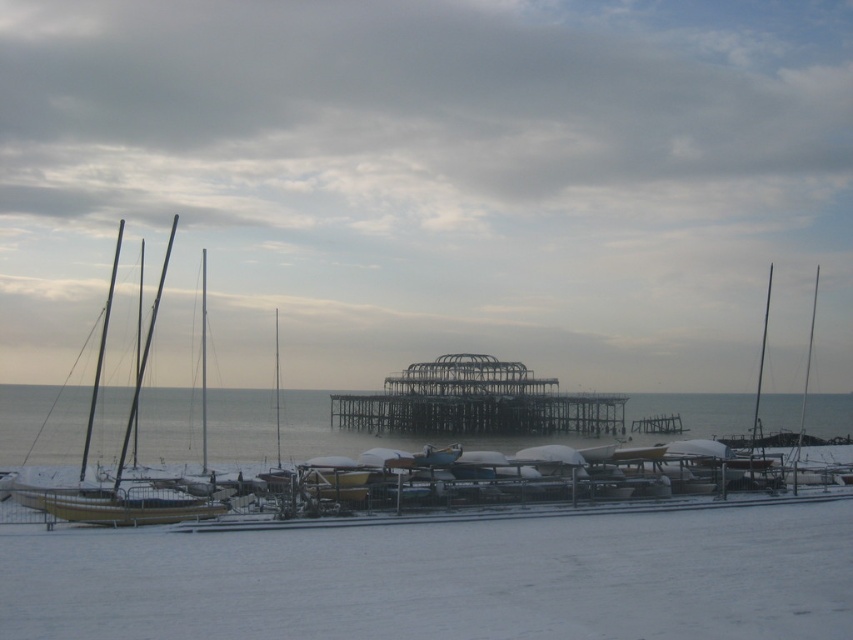
Question: Which of the following is the farthest from the observer?

Choices:
 (A) (263, 433)
 (B) (433, 432)
 (C) (126, 483)
 (D) (776, 589)

Answer: (B)

Question: Which of the following is the farthest from the observer?

Choices:
 (A) (239, 392)
 (B) (83, 611)
 (C) (196, 516)
 (D) (485, 422)

Answer: (A)

Question: Which point is farther from the camera taking this photo?

Choices:
 (A) (524, 429)
 (B) (138, 440)
 (C) (68, 608)

Answer: (A)

Question: Can you confirm if white matte snow at center is positioned above wooden sailboat at left?

Choices:
 (A) no
 (B) yes

Answer: (A)

Question: Can you confirm if white matte snow at center is smaller than wooden sailboat at left?

Choices:
 (A) no
 (B) yes

Answer: (B)

Question: Is white matte snow at center positioned in front of wooden sailboat at left?

Choices:
 (A) yes
 (B) no

Answer: (A)